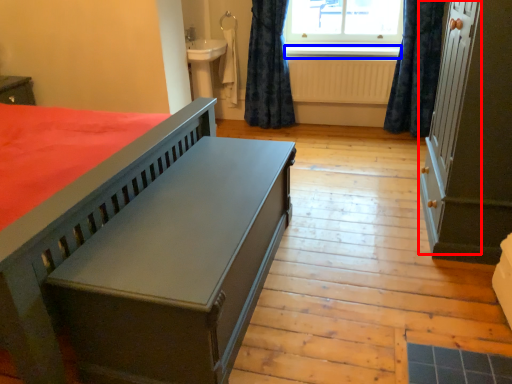
Question: Which object is closer to the camera taking this photo, screen door (highlighted by a red box) or window sill (highlighted by a blue box)?

Choices:
 (A) screen door
 (B) window sill

Answer: (A)